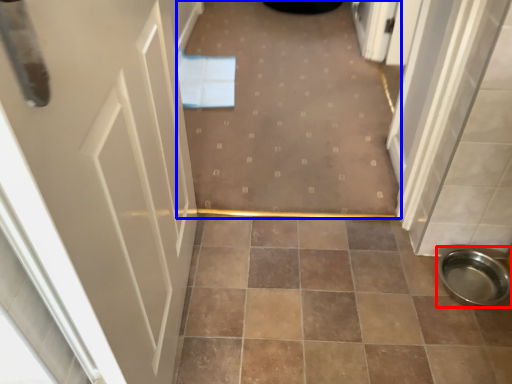
Question: Which of the following is the closest to the observer, toilet bowl (highlighted by a red box) or plain (highlighted by a blue box)?

Choices:
 (A) toilet bowl
 (B) plain

Answer: (A)